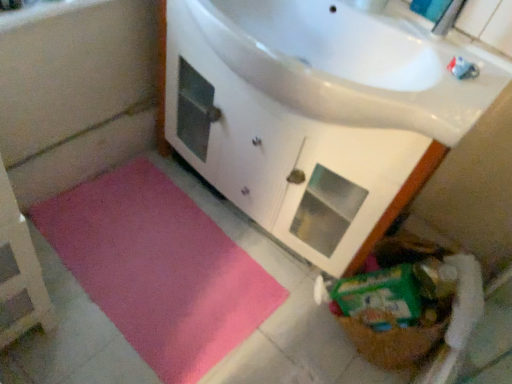
Question: Can you confirm if white glossy faucet at upper center is smaller than pink fabric bath mat at lower left?

Choices:
 (A) yes
 (B) no

Answer: (A)

Question: Does white glossy faucet at upper center have a lesser height compared to pink fabric bath mat at lower left?

Choices:
 (A) yes
 (B) no

Answer: (A)

Question: From a real-world perspective, is white glossy faucet at upper center physically below pink fabric bath mat at lower left?

Choices:
 (A) no
 (B) yes

Answer: (A)

Question: Can you confirm if white glossy faucet at upper center is positioned to the left of pink fabric bath mat at lower left?

Choices:
 (A) yes
 (B) no

Answer: (B)

Question: From the image's perspective, is white glossy faucet at upper center above pink fabric bath mat at lower left?

Choices:
 (A) no
 (B) yes

Answer: (B)

Question: From a real-world perspective, is white glossy faucet at upper center located higher than pink fabric bath mat at lower left?

Choices:
 (A) yes
 (B) no

Answer: (A)

Question: Considering the relative sizes of pink fabric bath mat at lower left and pink plush bath mat at lower left in the image provided, is pink fabric bath mat at lower left smaller than pink plush bath mat at lower left?

Choices:
 (A) yes
 (B) no

Answer: (A)

Question: Would you say pink fabric bath mat at lower left is outside pink plush bath mat at lower left?

Choices:
 (A) no
 (B) yes

Answer: (B)

Question: Is pink fabric bath mat at lower left to the left of pink plush bath mat at lower left from the viewer's perspective?

Choices:
 (A) no
 (B) yes

Answer: (B)

Question: Does pink fabric bath mat at lower left have a larger size compared to pink plush bath mat at lower left?

Choices:
 (A) no
 (B) yes

Answer: (A)

Question: Is the depth of pink fabric bath mat at lower left less than that of pink plush bath mat at lower left?

Choices:
 (A) no
 (B) yes

Answer: (A)

Question: From the image's perspective, is pink fabric bath mat at lower left on pink plush bath mat at lower left?

Choices:
 (A) no
 (B) yes

Answer: (B)

Question: Does pink fabric bath mat at lower left have a lesser width compared to white glossy cabinet at upper center?

Choices:
 (A) no
 (B) yes

Answer: (B)